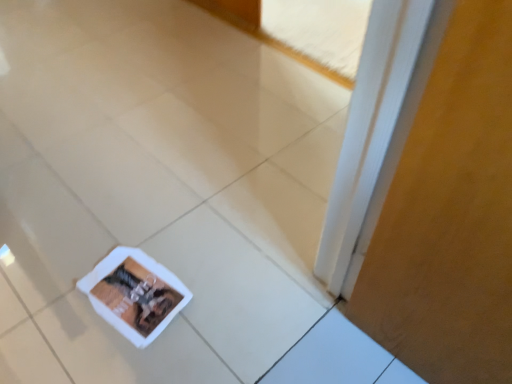
Find the location of a particular element. This screenshot has height=384, width=512. white glossy magazine at lower left is located at coordinates (135, 294).

This screenshot has height=384, width=512. What do you see at coordinates (135, 294) in the screenshot?
I see `white glossy magazine at lower left` at bounding box center [135, 294].

Find the location of a particular element. Image resolution: width=512 pixels, height=384 pixels. white glossy magazine at lower left is located at coordinates (135, 294).